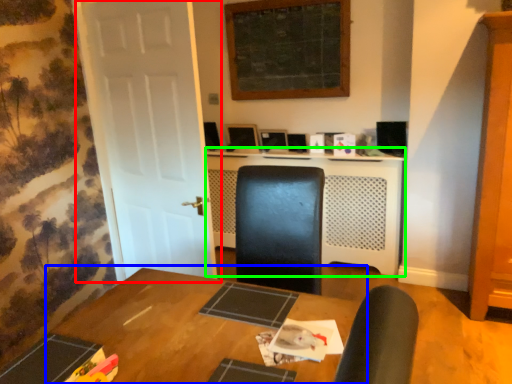
Question: Which is farther away from door (highlighted by a red box)? table (highlighted by a blue box) or computer desk (highlighted by a green box)?

Choices:
 (A) table
 (B) computer desk

Answer: (B)